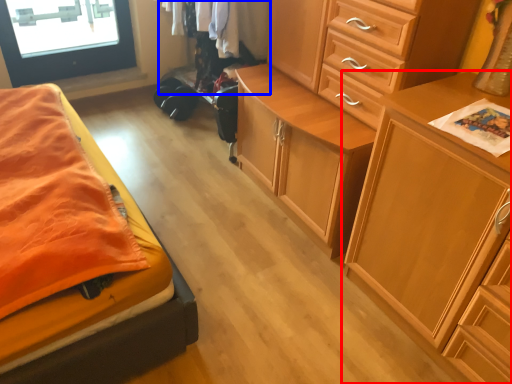
Question: Among these objects, which one is nearest to the camera, chest of drawers (highlighted by a red box) or clothing (highlighted by a blue box)?

Choices:
 (A) chest of drawers
 (B) clothing

Answer: (A)